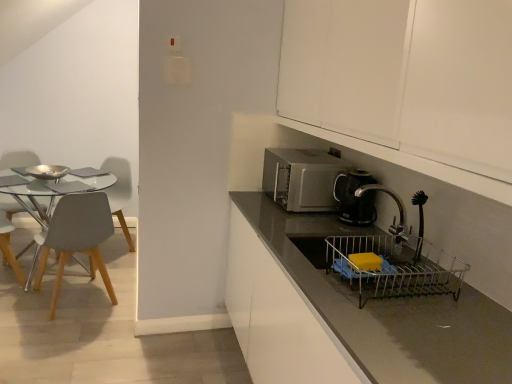
Question: Does metallic silver sink at lower right lie in front of matte gray chair at left, the 3th chair in the left-to-right sequence?

Choices:
 (A) no
 (B) yes

Answer: (B)

Question: Can you confirm if metallic silver sink at lower right is wider than matte gray chair at left, arranged as the 2th chair when viewed from the right?

Choices:
 (A) no
 (B) yes

Answer: (A)

Question: Is the depth of metallic silver sink at lower right greater than that of matte gray chair at left, the 3th chair in the left-to-right sequence?

Choices:
 (A) yes
 (B) no

Answer: (B)

Question: Is metallic silver sink at lower right at the right side of matte gray chair at left, the 3th chair in the left-to-right sequence?

Choices:
 (A) no
 (B) yes

Answer: (B)

Question: From the image's perspective, is metallic silver sink at lower right under matte gray chair at left, arranged as the 2th chair when viewed from the right?

Choices:
 (A) no
 (B) yes

Answer: (B)

Question: Could you tell me if metallic silver sink at lower right is facing matte gray chair at left, arranged as the 2th chair when viewed from the right?

Choices:
 (A) yes
 (B) no

Answer: (B)

Question: Considering the relative positions of metallic silver sink at lower right and light gray plastic chair at left, which is counted as the 2th chair, starting from the left, in the image provided, is metallic silver sink at lower right to the left of light gray plastic chair at left, which is counted as the 2th chair, starting from the left, from the viewer's perspective?

Choices:
 (A) yes
 (B) no

Answer: (B)

Question: Is metallic silver sink at lower right further to camera compared to light gray plastic chair at left, which is the third chair from right to left?

Choices:
 (A) yes
 (B) no

Answer: (B)

Question: Is metallic silver sink at lower right positioned far away from light gray plastic chair at left, which is the third chair from right to left?

Choices:
 (A) yes
 (B) no

Answer: (A)

Question: From the image's perspective, would you say metallic silver sink at lower right is shown under light gray plastic chair at left, which is the third chair from right to left?

Choices:
 (A) no
 (B) yes

Answer: (B)

Question: From the image's perspective, is metallic silver sink at lower right over light gray plastic chair at left, which is the third chair from right to left?

Choices:
 (A) yes
 (B) no

Answer: (B)

Question: From a real-world perspective, is metallic silver sink at lower right located beneath light gray plastic chair at left, which is counted as the 2th chair, starting from the left?

Choices:
 (A) no
 (B) yes

Answer: (A)

Question: Is white matte cabinet at upper right not near matte gray chair at left, the 3th chair in the left-to-right sequence?

Choices:
 (A) yes
 (B) no

Answer: (A)